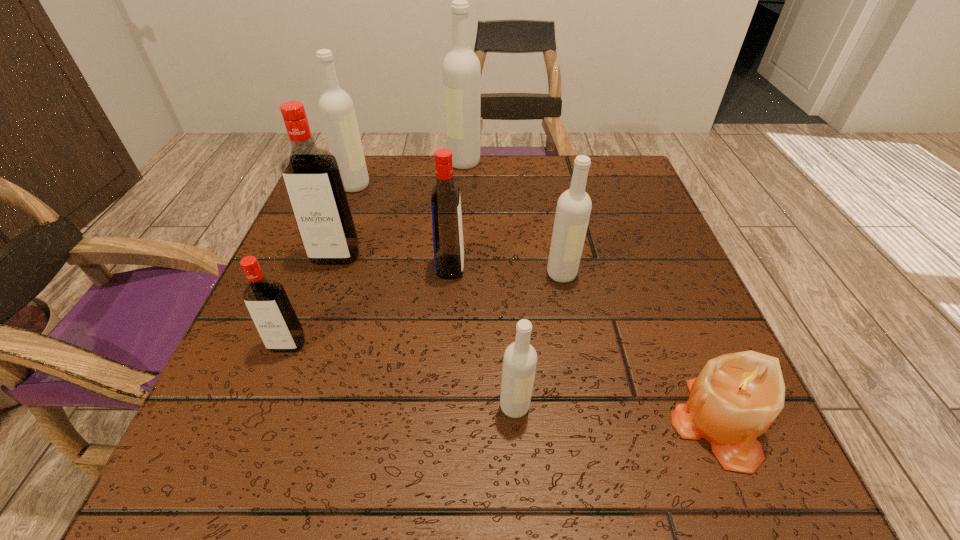
Locate an element on the screen. The height and width of the screenshot is (540, 960). vacant space at the far left corner is located at coordinates (360, 194).

In the image, there is a desktop. Where is `vacant region at the near left corner`? vacant region at the near left corner is located at coordinates click(279, 478).

Locate an element on the screen. The image size is (960, 540). vacant space at the far right corner of the desktop is located at coordinates (602, 210).

This screenshot has width=960, height=540. Identify the location of vacant space at the near right corner of the desktop. (766, 485).

Identify the location of vacant space that is in between the third white vodka from right to left and the rightmost vodka. (513, 218).

Image resolution: width=960 pixels, height=540 pixels. What are the coordinates of `free spot between the biggest red vodka and the smallest red vodka` in the screenshot? It's located at (311, 300).

Find the location of a particular element. This screenshot has height=540, width=960. vacant area that lies between the second smallest red vodka and the sixth vodka from left to right is located at coordinates (483, 337).

Find the location of `blank region between the biggest red vodka and the rightmost red vodka`. blank region between the biggest red vodka and the rightmost red vodka is located at coordinates (393, 262).

Locate an element on the screen. vacant space in between the seventh object from left to right and the third object from right to left is located at coordinates (539, 340).

At what (x,y) coordinates should I click in order to perform the action: click on unoccupied position between the biggest red vodka and the second nearest vodka. Please return your answer as a coordinate pair (x, y). Looking at the image, I should click on (311, 300).